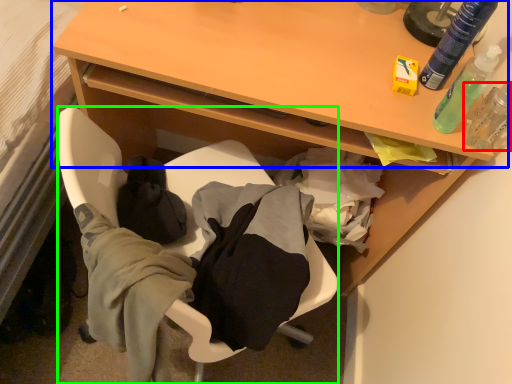
Question: Estimate the real-world distances between objects in this image. Which object is closer to toiletry (highlighted by a red box), table (highlighted by a blue box) or chair (highlighted by a green box)?

Choices:
 (A) table
 (B) chair

Answer: (A)